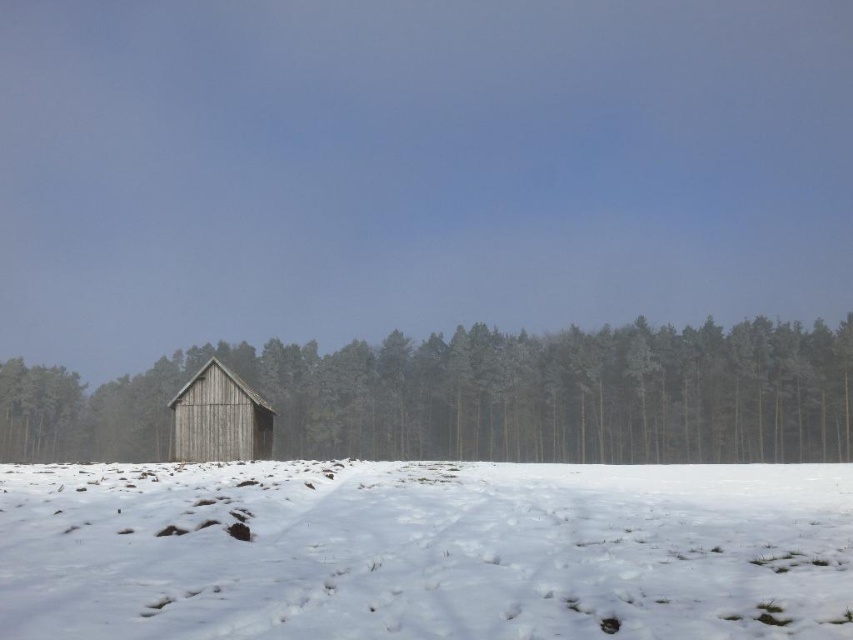
Question: Among these objects, which one is farthest from the camera?

Choices:
 (A) white fluffy snow at center
 (B) weathered wood barn at center

Answer: (B)

Question: Can you confirm if white fluffy snow at center is positioned to the left of weathered wood shed at center?

Choices:
 (A) no
 (B) yes

Answer: (A)

Question: Which point is farther from the camera taking this photo?

Choices:
 (A) (294, 364)
 (B) (184, 531)

Answer: (A)

Question: Can you confirm if white fluffy snow at center is smaller than weathered wood shed at center?

Choices:
 (A) yes
 (B) no

Answer: (A)

Question: Does weathered wood shed at center have a smaller size compared to weathered wood barn at center?

Choices:
 (A) yes
 (B) no

Answer: (B)

Question: Which of the following is the closest to the observer?

Choices:
 (A) weathered wood barn at center
 (B) weathered wood shed at center

Answer: (A)